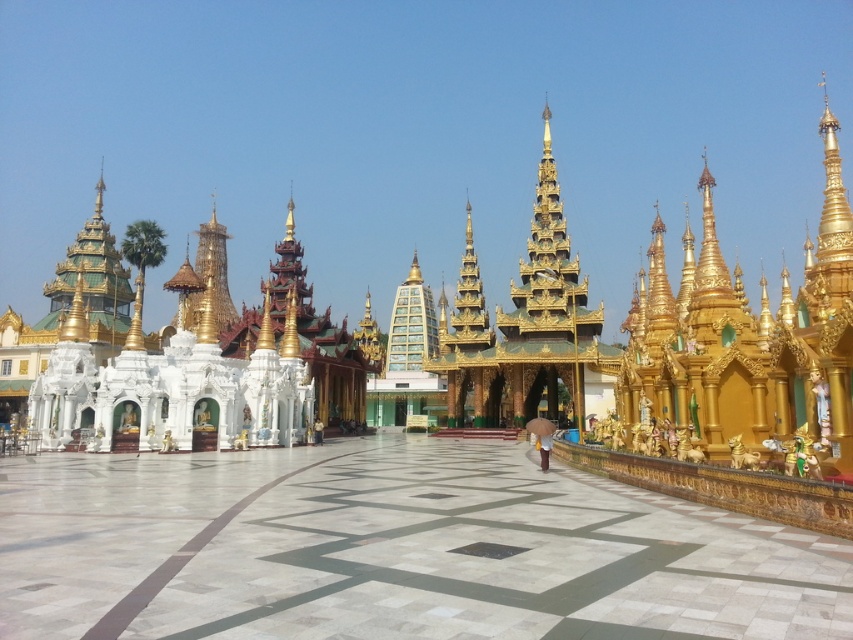
Question: Where is white marble plaza at center located in relation to brown fabric umbrella at center in the image?

Choices:
 (A) left
 (B) right

Answer: (A)

Question: Is white marble plaza at center in front of brown fabric umbrella at center?

Choices:
 (A) yes
 (B) no

Answer: (A)

Question: Is the position of white marble plaza at center more distant than that of brown fabric umbrella at center?

Choices:
 (A) yes
 (B) no

Answer: (B)

Question: Which object is closer to the camera taking this photo?

Choices:
 (A) brown fabric umbrella at center
 (B) white marble plaza at center

Answer: (B)

Question: Which object is farther from the camera taking this photo?

Choices:
 (A) white marble plaza at center
 (B) brown fabric umbrella at center

Answer: (B)